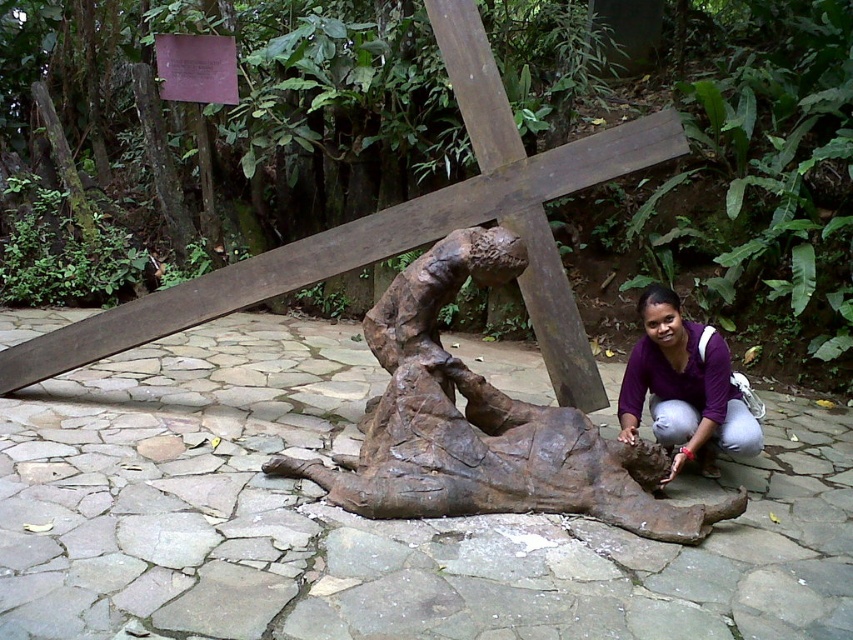
Is point (505, 124) positioned behind point (650, 336)?

Yes, point (505, 124) is farther from viewer.

Is rusty wood crucifix at center thinner than purple matte shirt at lower right?

In fact, rusty wood crucifix at center might be wider than purple matte shirt at lower right.

Find the location of a particular element. rusty wood crucifix at center is located at coordinates (405, 230).

Find the location of a particular element. rusty metal sculpture at center is located at coordinates (485, 422).

Can you confirm if rusty metal sculpture at center is positioned to the left of purple matte shirt at lower right?

Yes, rusty metal sculpture at center is to the left of purple matte shirt at lower right.

What do you see at coordinates (485, 422) in the screenshot?
I see `rusty metal sculpture at center` at bounding box center [485, 422].

This screenshot has height=640, width=853. Identify the location of rusty metal sculpture at center. (485, 422).

Does point (392, 374) lie in front of point (231, 294)?

Yes.

Measure the distance between point (553,490) and camera.

3.83 meters

Between point (427, 316) and point (548, 228), which one is positioned in front?

Point (427, 316) is in front.

Where is `rusty metal sculpture at center`? rusty metal sculpture at center is located at coordinates (485, 422).